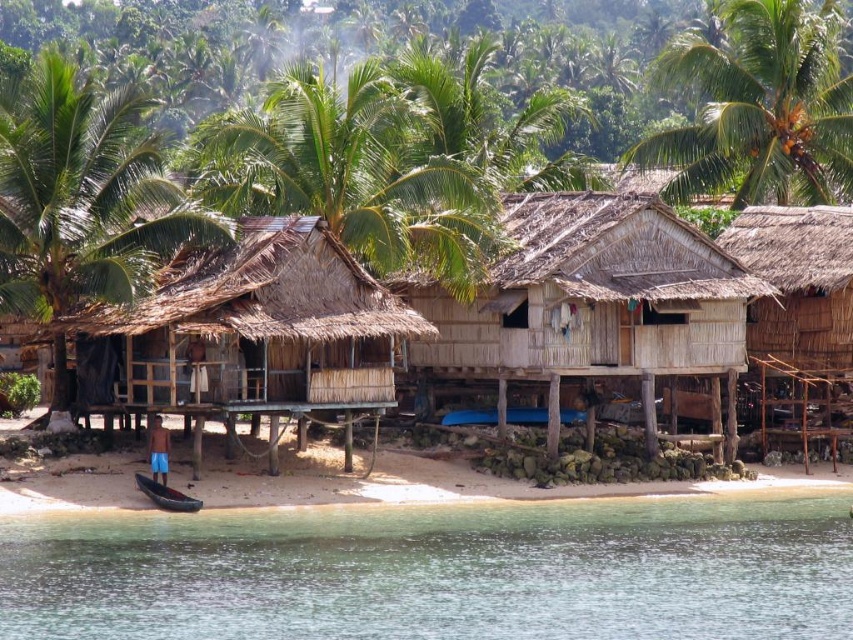
Can you confirm if green leafy palm tree at upper center is shorter than green leafy palm tree at upper left?

Yes.

Is green leafy palm tree at upper center in front of green leafy palm tree at upper left?

No, it is behind green leafy palm tree at upper left.

Which is in front, point (439, 221) or point (160, 188)?

Point (160, 188) is in front.

What are the coordinates of `green leafy palm tree at upper center` in the screenshot? It's located at (354, 173).

Who is positioned more to the right, green leafy palm tree at upper left or wooden canoe at lower left?

From the viewer's perspective, wooden canoe at lower left appears more on the right side.

Which of these two, green leafy palm tree at upper left or wooden canoe at lower left, stands taller?

green leafy palm tree at upper left is taller.

Where is `green leafy palm tree at upper left`? green leafy palm tree at upper left is located at coordinates (84, 196).

Does thatched bamboo hut at center have a larger size compared to blue plastic boat at center?

Yes.

Does thatched bamboo hut at center have a lesser height compared to blue plastic boat at center?

Incorrect, thatched bamboo hut at center's height does not fall short of blue plastic boat at center's.

Between point (614, 372) and point (532, 416), which one is positioned in front?

Point (614, 372) is more forward.

Where is `thatched bamboo hut at center`? Image resolution: width=853 pixels, height=640 pixels. thatched bamboo hut at center is located at coordinates (589, 300).